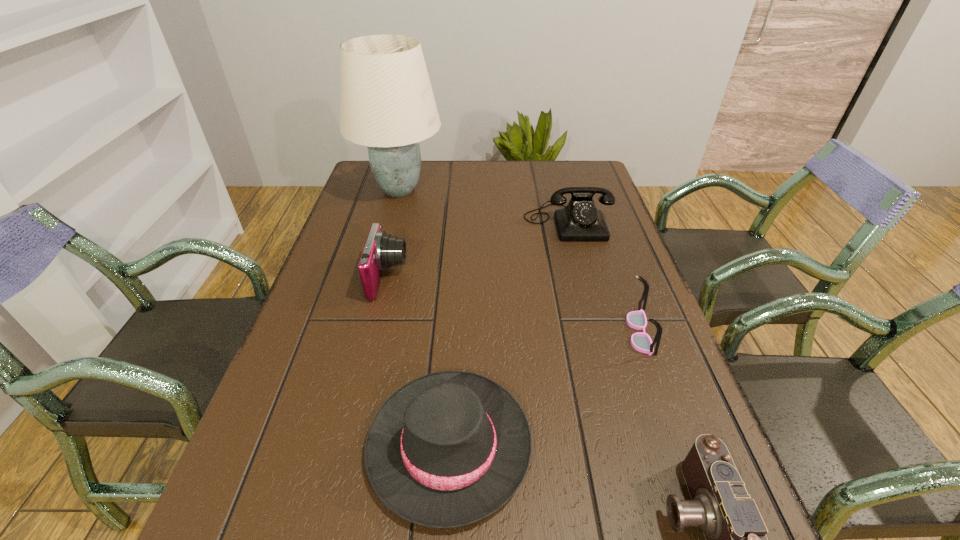
Locate an element on the screen. Image resolution: width=960 pixels, height=540 pixels. vacant space at the far left corner of the desktop is located at coordinates (364, 167).

Find the location of a particular element. The height and width of the screenshot is (540, 960). free space between the dress hat and the tallest object is located at coordinates (424, 318).

Identify the location of blank region between the lampshade and the telephone. (484, 206).

You are a GUI agent. You are given a task and a screenshot of the screen. Output one action in this format:
    pyautogui.click(x=<x>, y=<y>)
    Task: Click on the vacant region between the fourth farthest object and the dress hat
    The image size is (960, 540).
    Given the screenshot: What is the action you would take?
    pyautogui.click(x=544, y=389)

The width and height of the screenshot is (960, 540). What are the coordinates of `vacant area between the telephone and the taller camera` in the screenshot? It's located at (478, 250).

Locate an element on the screen. This screenshot has width=960, height=540. empty space that is in between the dress hat and the telephone is located at coordinates (509, 334).

I want to click on unoccupied area between the lampshade and the dress hat, so click(424, 318).

Identify the location of free area in between the spectacles and the lampshade. (519, 261).

Find the location of a particular element. empty space that is in between the dress hat and the left camera is located at coordinates (419, 362).

At what (x,y) coordinates should I click in order to perform the action: click on object that is the fifth nearest to the right camera. Please return your answer as a coordinate pair (x, y). Looking at the image, I should click on (386, 100).